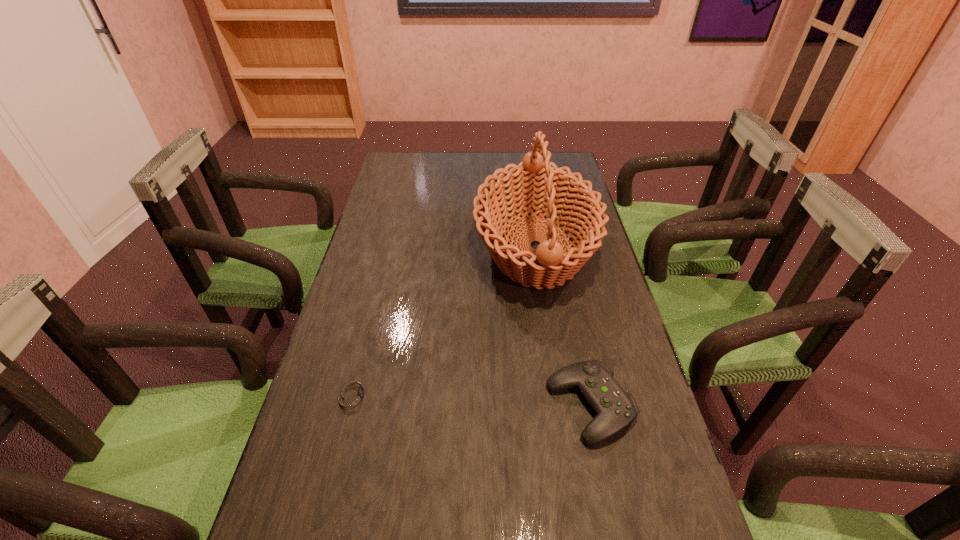
At what (x,y) coordinates should I click in order to perform the action: click on control positioned at the right edge. Please return your answer as a coordinate pair (x, y). Looking at the image, I should click on (615, 408).

Where is `free space at the left edge of the desktop`? This screenshot has width=960, height=540. free space at the left edge of the desktop is located at coordinates (380, 309).

In the image, there is a desktop. At what (x,y) coordinates should I click in order to perform the action: click on free space at the right edge. Please return your answer as a coordinate pair (x, y). The image size is (960, 540). Looking at the image, I should click on click(662, 428).

In the image, there is a desktop. Where is `vacant space at the far left corner`? The width and height of the screenshot is (960, 540). vacant space at the far left corner is located at coordinates (419, 166).

You are a GUI agent. You are given a task and a screenshot of the screen. Output one action in this format:
    pyautogui.click(x=<x>, y=<y>)
    Task: Click on the vacant area that lies between the control and the watch
    
    Given the screenshot: What is the action you would take?
    pyautogui.click(x=471, y=400)

Where is `free point between the farthest object and the shortest object`? free point between the farthest object and the shortest object is located at coordinates (444, 321).

You are a GUI agent. You are given a task and a screenshot of the screen. Output one action in this format:
    pyautogui.click(x=<x>, y=<y>)
    Task: Click on the empty space between the control and the watch
    Image resolution: width=960 pixels, height=540 pixels.
    Given the screenshot: What is the action you would take?
    pyautogui.click(x=471, y=400)

Where is `empty space that is in between the control and the farthest object`? The height and width of the screenshot is (540, 960). empty space that is in between the control and the farthest object is located at coordinates (563, 327).

You are a GUI agent. You are given a task and a screenshot of the screen. Output one action in this format:
    pyautogui.click(x=<x>, y=<y>)
    Task: Click on the vacant region between the watch and the basket
    This screenshot has width=960, height=540.
    Given the screenshot: What is the action you would take?
    pyautogui.click(x=444, y=321)

Find the location of `object that is the closest to the second tallest object`. object that is the closest to the second tallest object is located at coordinates point(534,186).